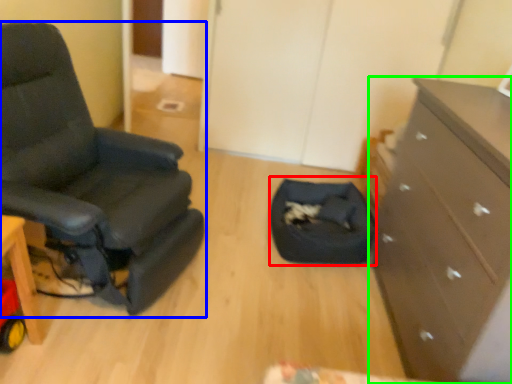
Question: Considering the real-world distances, which object is farthest from footrest (highlighted by a red box)? chair (highlighted by a blue box) or chest of drawers (highlighted by a green box)?

Choices:
 (A) chair
 (B) chest of drawers

Answer: (A)